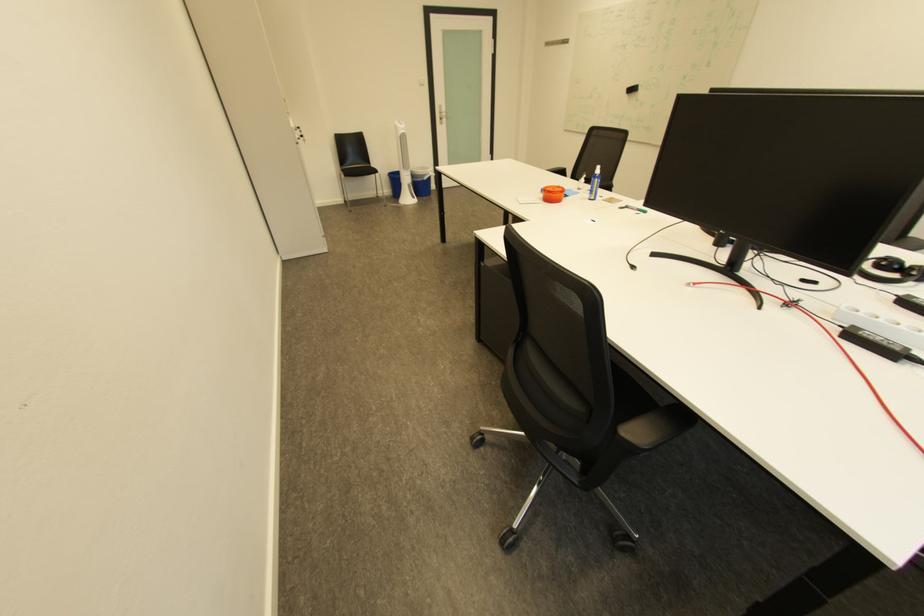
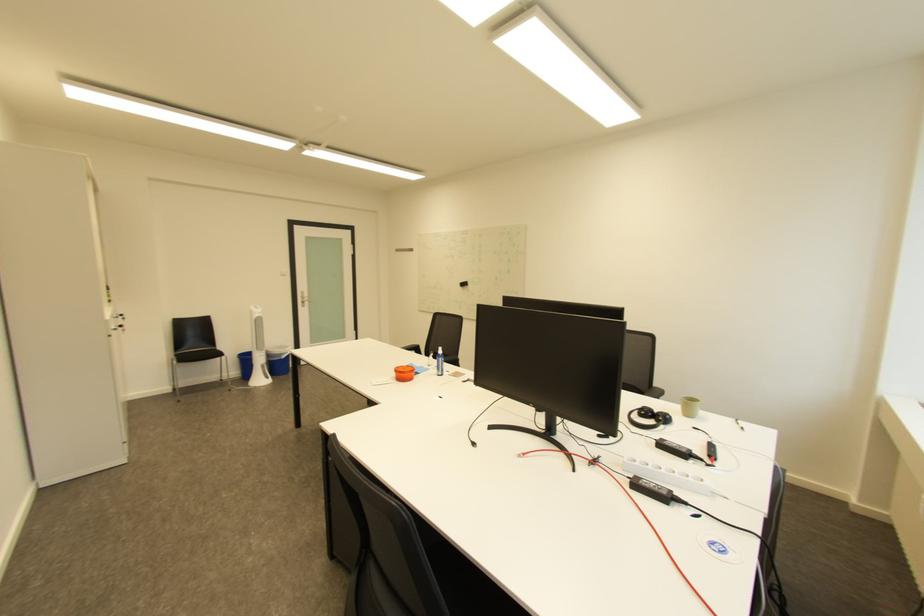
The point at (419, 187) is marked in the first image. Where is the corresponding point in the second image?

(273, 367)